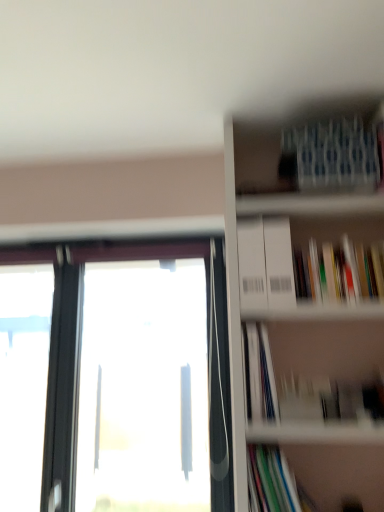
Question: Should I look upward or downward to see white cardboard bookcase at upper right?

Choices:
 (A) up
 (B) down

Answer: (B)

Question: Could multicolored paperbacks at upper right, marked as the 2th book in a top-to-bottom arrangement, be considered to be inside transparent glass window at left?

Choices:
 (A) no
 (B) yes

Answer: (A)

Question: Can you confirm if transparent glass window at left is positioned to the left of multicolored paperbacks at upper right, marked as the 2th book in a top-to-bottom arrangement?

Choices:
 (A) no
 (B) yes

Answer: (B)

Question: Is transparent glass window at left shorter than multicolored paperbacks at upper right, the third book ordered from the bottom?

Choices:
 (A) no
 (B) yes

Answer: (A)

Question: Is transparent glass window at left not close to multicolored paperbacks at upper right, marked as the 2th book in a top-to-bottom arrangement?

Choices:
 (A) yes
 (B) no

Answer: (B)

Question: Can you confirm if transparent glass window at left is bigger than multicolored paperbacks at upper right, marked as the 2th book in a top-to-bottom arrangement?

Choices:
 (A) yes
 (B) no

Answer: (A)

Question: Is transparent glass window at left outside multicolored paperbacks at upper right, marked as the 2th book in a top-to-bottom arrangement?

Choices:
 (A) no
 (B) yes

Answer: (B)

Question: From a real-world perspective, is transparent glass window at left located higher than blue textured fabric at upper right, the fourth book in the bottom-to-top sequence?

Choices:
 (A) yes
 (B) no

Answer: (B)

Question: From the image's perspective, is transparent glass window at left beneath blue textured fabric at upper right, the 1th book positioned from the top?

Choices:
 (A) yes
 (B) no

Answer: (A)

Question: Is transparent glass window at left in front of blue textured fabric at upper right, the 1th book positioned from the top?

Choices:
 (A) no
 (B) yes

Answer: (A)

Question: Can you confirm if transparent glass window at left is wider than blue textured fabric at upper right, the fourth book in the bottom-to-top sequence?

Choices:
 (A) yes
 (B) no

Answer: (B)

Question: Does transparent glass window at left have a lesser height compared to blue textured fabric at upper right, the 1th book positioned from the top?

Choices:
 (A) no
 (B) yes

Answer: (A)

Question: Is transparent glass window at left directly adjacent to blue textured fabric at upper right, the fourth book in the bottom-to-top sequence?

Choices:
 (A) no
 (B) yes

Answer: (A)

Question: Does multicolored paperbacks at upper right, marked as the 2th book in a top-to-bottom arrangement, have a lesser height compared to transparent glass window at left?

Choices:
 (A) yes
 (B) no

Answer: (A)